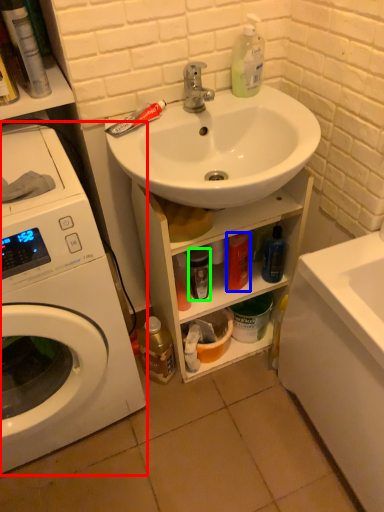
Question: Which is nearer to the washing machine (highlighted by a red box)? toiletry (highlighted by a blue box) or toiletry (highlighted by a green box).

Choices:
 (A) toiletry
 (B) toiletry

Answer: (B)